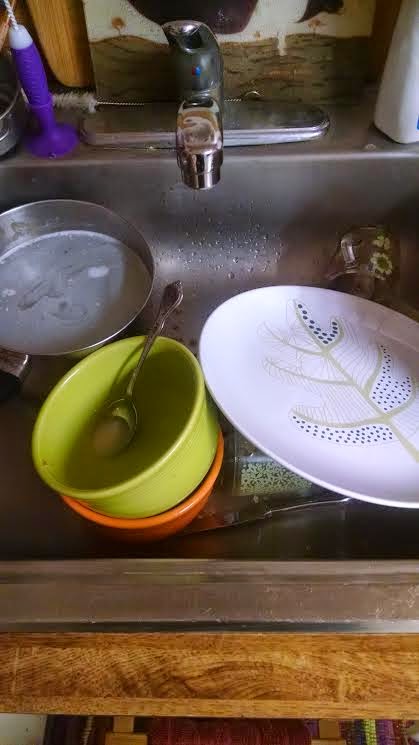
Locate an element on the screen. handle of sink is located at coordinates (182, 28).